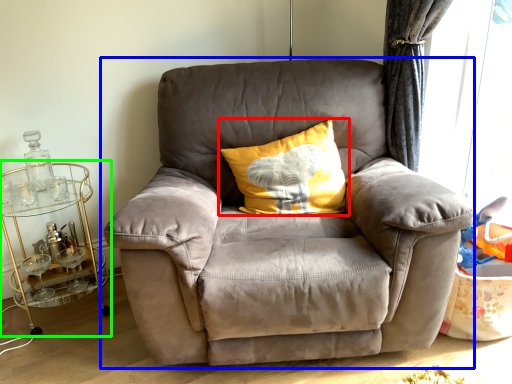
Question: Estimate the real-world distances between objects in this image. Which object is closer to pillow (highlighted by a red box), chair (highlighted by a blue box) or table (highlighted by a green box)?

Choices:
 (A) chair
 (B) table

Answer: (A)